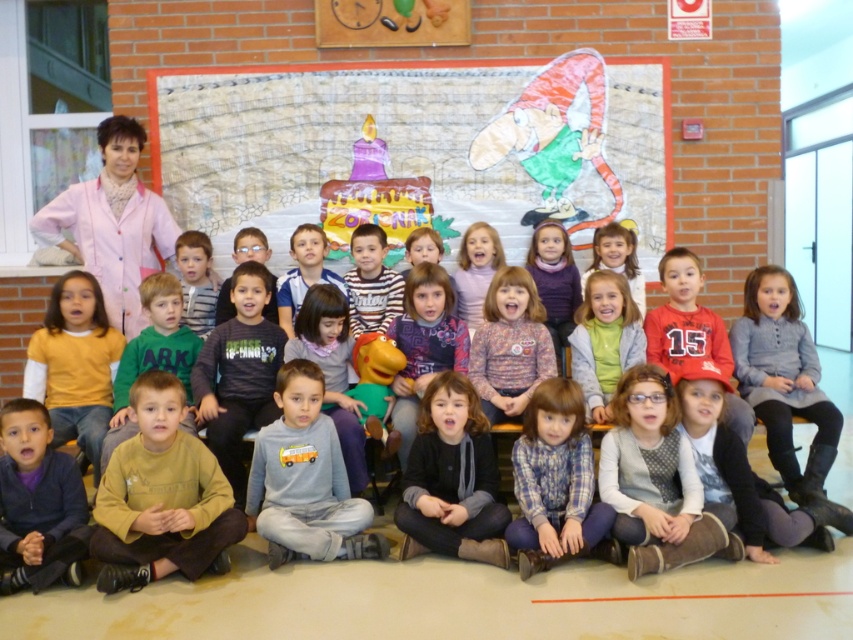
Who is lower down, white textured sweater at center or matte yellow shirt at center?

Positioned lower is white textured sweater at center.

Is white textured sweater at center wider than matte yellow shirt at center?

Correct, the width of white textured sweater at center exceeds that of matte yellow shirt at center.

Who is more forward, (712, 544) or (103, 385)?

Point (712, 544) is in front.

Locate an element on the screen. white textured sweater at center is located at coordinates (654, 480).

Looking at this image, can you confirm if cartoonish paper collage at upper center is positioned below matte yellow shirt at center?

No.

Is point (285, 122) more distant than point (71, 292)?

Yes, it is.

In order to click on cartoonish paper collage at upper center in this screenshot , I will do `click(418, 148)`.

This screenshot has height=640, width=853. I want to click on pink fabric at upper left, so click(113, 224).

Who is more distant from viewer, (74, 248) or (453, 419)?

The point (74, 248) is behind.

Where is `pink fabric at upper left`? This screenshot has height=640, width=853. pink fabric at upper left is located at coordinates (113, 224).